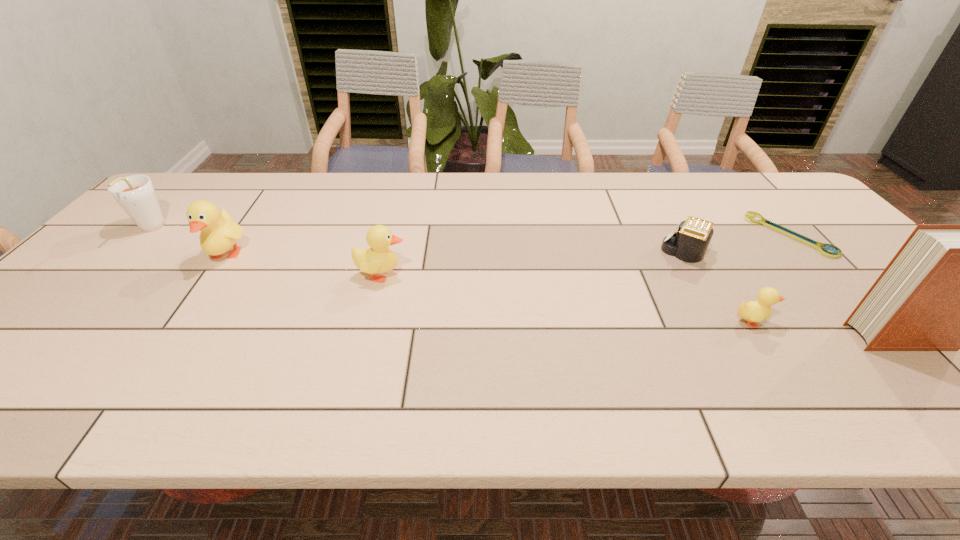
Please mark a free spot for a new duckling to balance the arrangement. Please provide its 2D coordinates. Your answer should be formatted as a tuple, i.e. [(x, y)], where the tuple contains the x and y coordinates of a point satisfying the conditions above.

[(556, 296)]